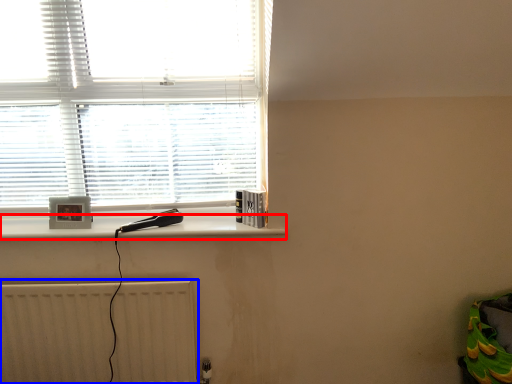
Question: Among these objects, which one is nearest to the camera, ledge (highlighted by a red box) or radiator (highlighted by a blue box)?

Choices:
 (A) ledge
 (B) radiator

Answer: (B)